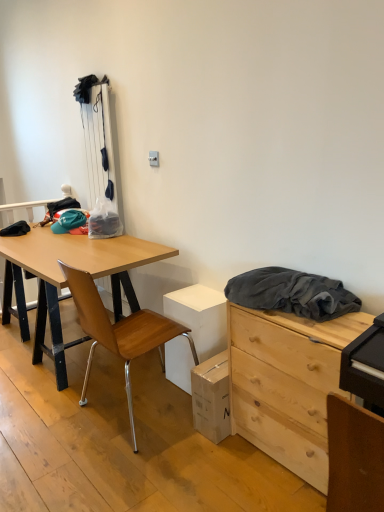
Find the location of a particular element. wooden at left is located at coordinates (119, 331).

In order to click on natural wood chest of drawers at right in this screenshot , I will do pos(287,384).

What do you see at coordinates (287, 384) in the screenshot?
I see `natural wood chest of drawers at right` at bounding box center [287, 384].

Where is `wooden at left`? wooden at left is located at coordinates (119, 331).

Which is farther, (299, 351) or (85, 382)?

The point (85, 382) is more distant.

Based on the photo, can you see natural wood chest of drawers at right touching wooden at left?

natural wood chest of drawers at right is not next to wooden at left, and they're not touching.

Which of these two, natural wood chest of drawers at right or wooden at left, is smaller?

natural wood chest of drawers at right.

Is natural wood chest of drawers at right surrounding wooden at left?

Actually, wooden at left is outside natural wood chest of drawers at right.

Which of these two, natural wood chest of drawers at right or dark gray fabric at upper right, stands shorter?

dark gray fabric at upper right.

Find the location of a particular element. The width and height of the screenshot is (384, 512). chest of drawers to the right of dark gray fabric at upper right is located at coordinates (287, 384).

From the image's perspective, which is below, natural wood chest of drawers at right or dark gray fabric at upper right?

natural wood chest of drawers at right appears lower in the image.

From the picture: Is natural wood chest of drawers at right in front of dark gray fabric at upper right?

Yes, natural wood chest of drawers at right is closer to the viewer.

From the image's perspective, would you say dark gray fabric at upper right is positioned over wooden at left?

Yes, from the image's perspective, dark gray fabric at upper right is on top of wooden at left.

Which is more to the right, dark gray fabric at upper right or wooden at left?

dark gray fabric at upper right.

The height and width of the screenshot is (512, 384). I want to click on clothing that appears on the right of wooden at left, so click(292, 293).

Which object is further away from the camera, dark gray fabric at upper right or wooden at left?

Positioned behind is wooden at left.

Considering the relative positions of dark gray fabric at upper right and natural wood chest of drawers at right in the image provided, is dark gray fabric at upper right behind natural wood chest of drawers at right?

Yes, dark gray fabric at upper right is behind natural wood chest of drawers at right.

Can you tell me how much dark gray fabric at upper right and natural wood chest of drawers at right differ in facing direction?

The facing directions of dark gray fabric at upper right and natural wood chest of drawers at right are 0.00443 degrees apart.

Image resolution: width=384 pixels, height=512 pixels. What are the coordinates of `chest of drawers below the dark gray fabric at upper right (from the image's perspective)` in the screenshot? It's located at (287, 384).

Is natural wood chest of drawers at right inside dark gray fabric at upper right?

No.

Is wooden at left inside or outside of natural wood chest of drawers at right?

wooden at left is spatially situated outside natural wood chest of drawers at right.

Is wooden at left aimed at natural wood chest of drawers at right?

No, wooden at left is not aimed at natural wood chest of drawers at right.

Can you tell me how much wooden at left and natural wood chest of drawers at right differ in facing direction?

They differ by 180 degrees in their facing directions.

Relative to dark gray fabric at upper right, is wooden at left in front or behind?

Clearly, wooden at left is behind dark gray fabric at upper right.

Is wooden at left facing towards dark gray fabric at upper right?

No, wooden at left is not aimed at dark gray fabric at upper right.

From the image's perspective, which is below, wooden at left or dark gray fabric at upper right?

wooden at left.

Based on the photo, who is shorter, wooden at left or dark gray fabric at upper right?

With less height is dark gray fabric at upper right.

The image size is (384, 512). In the image, there is a wooden at left. What are the coordinates of `the chest of drawers below it (from a real-world perspective)` in the screenshot? It's located at (287, 384).

This screenshot has height=512, width=384. Find the location of `chest of drawers in front of the dark gray fabric at upper right`. chest of drawers in front of the dark gray fabric at upper right is located at coordinates (287, 384).

Which object lies further to the anchor point wooden at left, dark gray fabric at upper right or natural wood chest of drawers at right?

→ The object further to wooden at left is dark gray fabric at upper right.

Based on the photo, looking at the image, which one is located closer to dark gray fabric at upper right, wooden at left or natural wood chest of drawers at right?

natural wood chest of drawers at right is closer to dark gray fabric at upper right.

Which object lies nearer to the anchor point wooden at left, natural wood chest of drawers at right or dark gray fabric at upper right?

Based on the image, natural wood chest of drawers at right appears to be nearer to wooden at left.

Looking at the image, which one is located closer to natural wood chest of drawers at right, dark gray fabric at upper right or wooden at left?

dark gray fabric at upper right lies closer to natural wood chest of drawers at right than the other object.

Which object lies nearer to the anchor point dark gray fabric at upper right, natural wood chest of drawers at right or wooden at left?

natural wood chest of drawers at right lies closer to dark gray fabric at upper right than the other object.

Estimate the real-world distances between objects in this image. Which object is further from natural wood chest of drawers at right, wooden at left or dark gray fabric at upper right?

wooden at left.

Find the location of a particular element. Image resolution: width=384 pixels, height=512 pixels. clothing between wooden at left and natural wood chest of drawers at right in the horizontal direction is located at coordinates (292, 293).